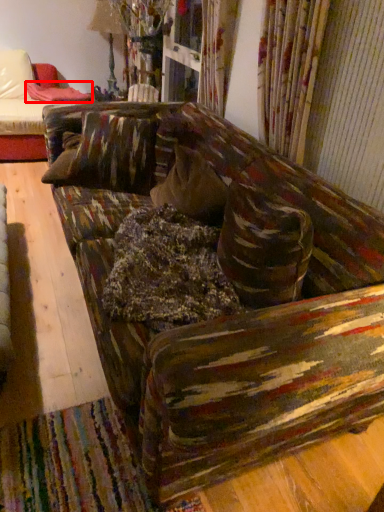
Question: Where is blanket (annotated by the red box) located in relation to studio couch in the image?

Choices:
 (A) left
 (B) right

Answer: (A)